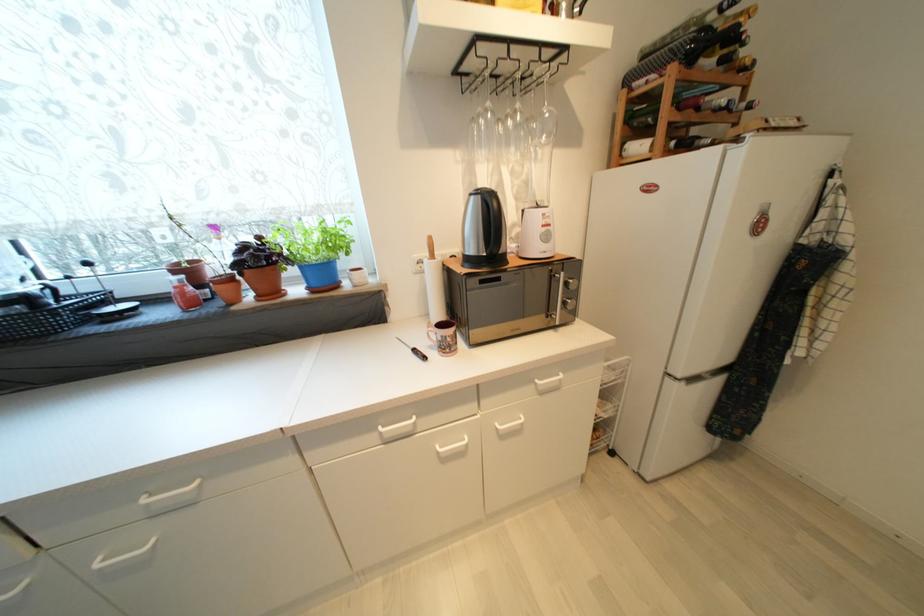
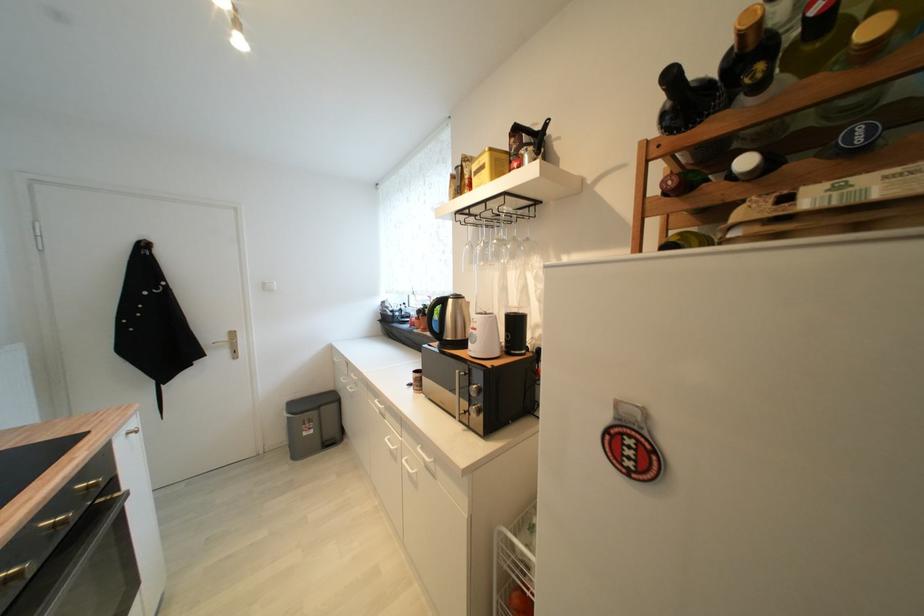
Find the pixel in the second image that matches point (554, 227) in the first image.

(480, 331)